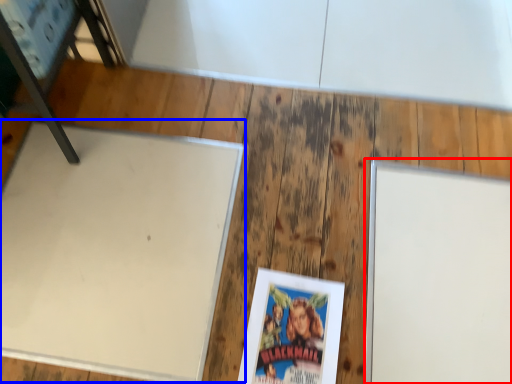
Question: Which object is closer to the camera taking this photo, bulletin board (highlighted by a red box) or table (highlighted by a blue box)?

Choices:
 (A) bulletin board
 (B) table

Answer: (A)